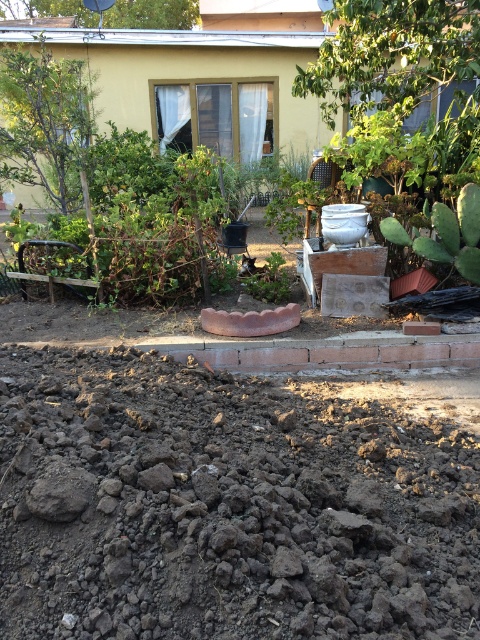
Is point (137, 576) behind point (467, 259)?

That is False.

Who is more forward, [336,403] or [479,269]?

Point [336,403] is more forward.

Where is `dull brown soil at lower center`? dull brown soil at lower center is located at coordinates (225, 506).

Is green spiky cactus at right above green matte plant at center?

Correct, green spiky cactus at right is located above green matte plant at center.

Is point (451, 211) closer to camera compared to point (245, 285)?

Yes, it is.

Which is in front, point (441, 256) or point (264, 289)?

Positioned in front is point (441, 256).

This screenshot has height=640, width=480. I want to click on green spiky cactus at right, so click(x=446, y=234).

Does dull brown soil at lower center appear under green matte plant at center?

Yes.

Who is shorter, dull brown soil at lower center or green matte plant at center?

With less height is green matte plant at center.

This screenshot has height=640, width=480. What do you see at coordinates (225, 506) in the screenshot?
I see `dull brown soil at lower center` at bounding box center [225, 506].

You are a GUI agent. You are given a task and a screenshot of the screen. Output one action in this format:
    pyautogui.click(x=<x>, y=<y>)
    Task: Click on the dull brown soil at lower center
    The width and height of the screenshot is (480, 640).
    Given the screenshot: What is the action you would take?
    pyautogui.click(x=225, y=506)